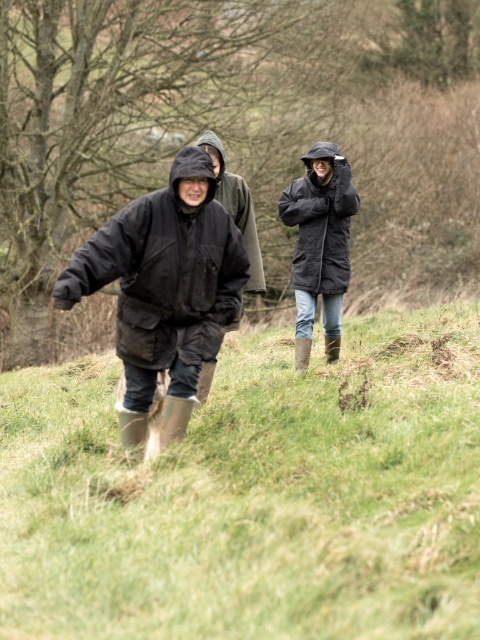
Between green grassy at lower left and black matte jacket at center, which one has more height?

black matte jacket at center

Is green grassy at lower left further to the viewer compared to black matte jacket at center?

No, it is in front of black matte jacket at center.

Does point (285, 332) lie behind point (124, 346)?

Yes, it is behind point (124, 346).

Locate an element on the screen. The height and width of the screenshot is (640, 480). green grassy at lower left is located at coordinates (253, 496).

Can you confirm if green grassy at lower left is thinner than black matte jacket at upper center?

Correct, green grassy at lower left's width is less than black matte jacket at upper center's.

Looking at this image, who is more distant from viewer, (180, 582) or (300, 248)?

Point (300, 248)

Where is `green grassy at lower left`? The image size is (480, 640). green grassy at lower left is located at coordinates coord(253,496).

Can you confirm if black matte jacket at center is positioned to the left of black matte jacket at upper center?

Indeed, black matte jacket at center is positioned on the left side of black matte jacket at upper center.

Can you confirm if black matte jacket at center is wider than black matte jacket at upper center?

Yes.

The image size is (480, 640). Describe the element at coordinates (165, 272) in the screenshot. I see `black matte jacket at center` at that location.

Locate an element on the screen. This screenshot has height=640, width=480. black matte jacket at center is located at coordinates (165, 272).